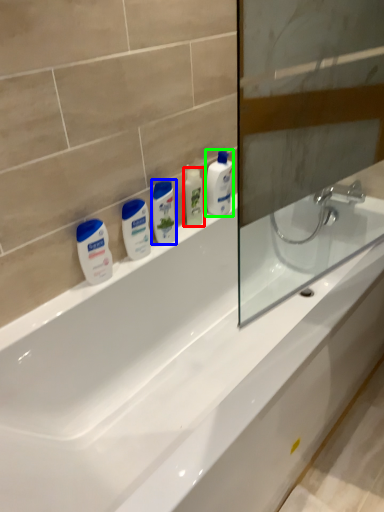
Question: Which object is positioned farthest from mouthwash (highlighted by a red box)? Select from mouthwash (highlighted by a blue box) and cleaning product (highlighted by a green box).

Choices:
 (A) mouthwash
 (B) cleaning product

Answer: (A)